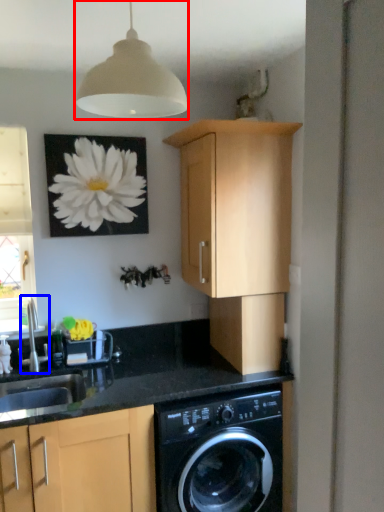
Question: Which point is closer to the camera, lamp (highlighted by a red box) or faucet (highlighted by a blue box)?

Choices:
 (A) lamp
 (B) faucet

Answer: (A)